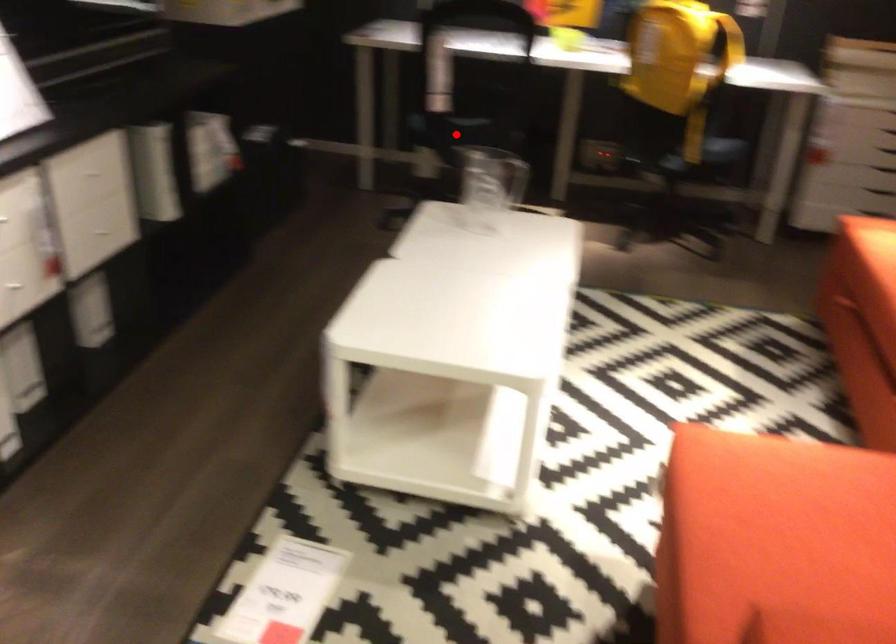
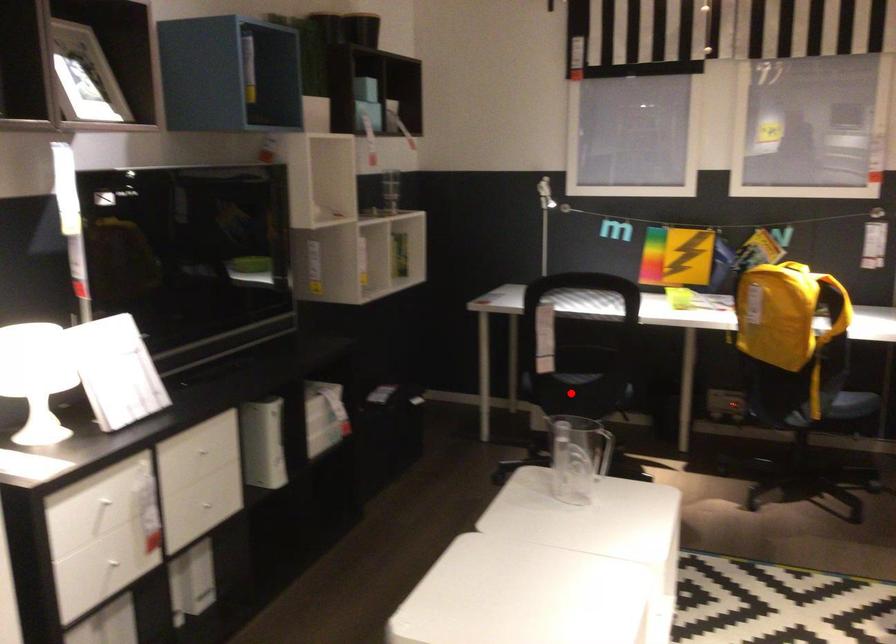
I am providing you with two images of the same scene from different viewpoints. A red point is marked on the first image and another point is marked on the second image. Do the highlighted points in image1 and image2 indicate the same real-world spot?

Yes